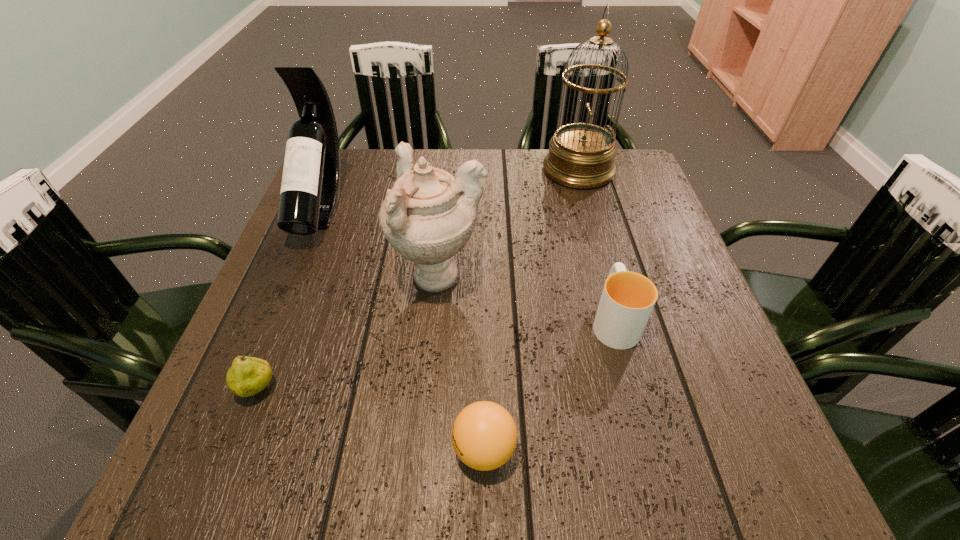
In the image, there is a desktop. Where is `vacant space at the right edge`? This screenshot has height=540, width=960. vacant space at the right edge is located at coordinates (615, 239).

Find the location of `blank space at the near left corner of the desktop`. blank space at the near left corner of the desktop is located at coordinates (211, 482).

Where is `vacant space at the far right corner of the desktop`? The image size is (960, 540). vacant space at the far right corner of the desktop is located at coordinates (618, 164).

Find the location of a particular element. vacant space at the near right corner is located at coordinates point(746,464).

Where is `free spot between the urn and the wine bottle`? Image resolution: width=960 pixels, height=540 pixels. free spot between the urn and the wine bottle is located at coordinates (380, 242).

You are a GUI agent. You are given a task and a screenshot of the screen. Output one action in this format:
    pyautogui.click(x=<x>, y=<y>)
    Task: Click on the vacant region between the urn and the birdcage
    Image resolution: width=960 pixels, height=540 pixels.
    Given the screenshot: What is the action you would take?
    pyautogui.click(x=509, y=224)

I want to click on vacant area that lies between the pear and the ping-pong ball, so click(x=372, y=419).

Find the location of a particular element. This screenshot has width=960, height=540. unoccupied position between the fifth farthest object and the urn is located at coordinates (348, 333).

The height and width of the screenshot is (540, 960). Find the location of `empty space between the wine bottle and the second nearest object`. empty space between the wine bottle and the second nearest object is located at coordinates (290, 299).

Find the location of a particular element. The width and height of the screenshot is (960, 540). free spot between the urn and the ping-pong ball is located at coordinates (462, 363).